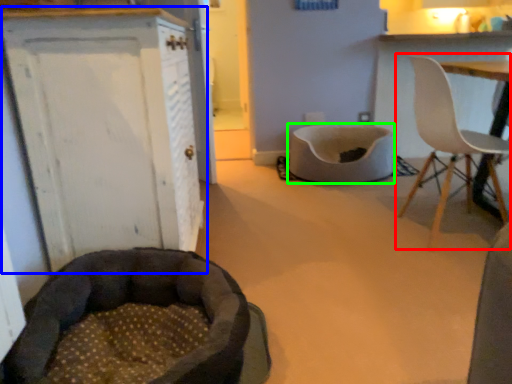
Question: Considering the real-world distances, which object is farthest from chair (highlighted by a red box)? cabinetry (highlighted by a blue box) or cat bed (highlighted by a green box)?

Choices:
 (A) cabinetry
 (B) cat bed

Answer: (A)